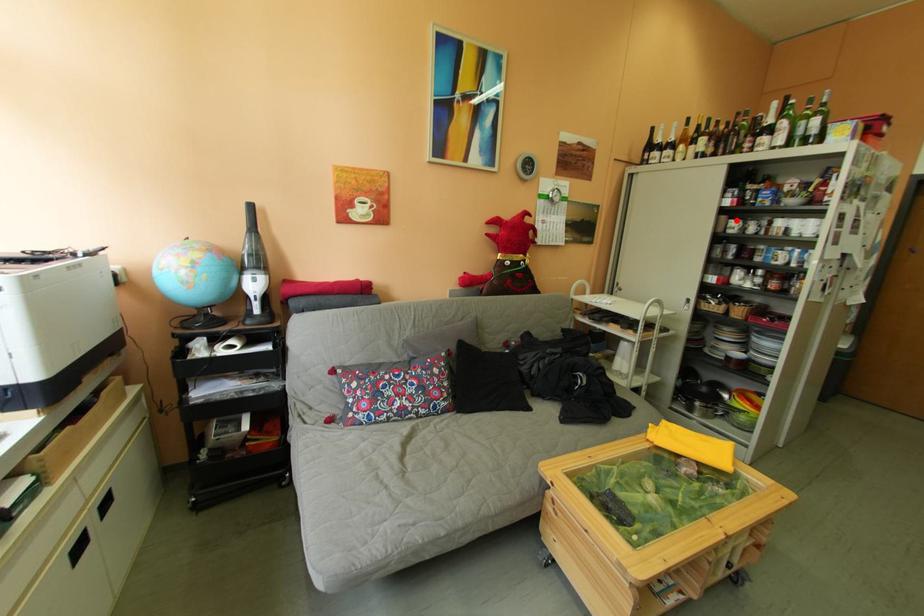
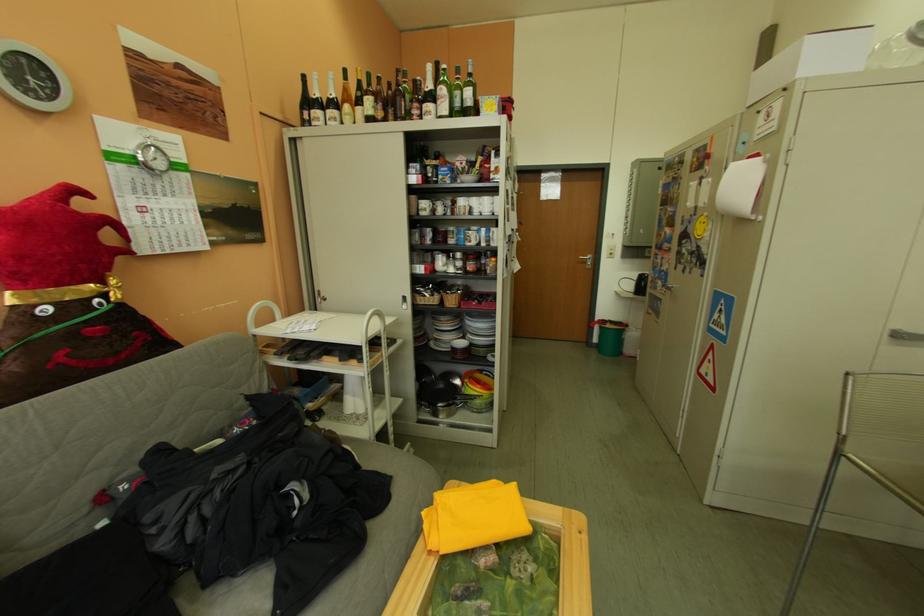
Question: I am providing you with two images of the same scene from different viewpoints. A red point is marked on the first image. At the location where the point appears in image 1, is it still visible in image 2?

Choices:
 (A) Yes
 (B) No

Answer: (A)